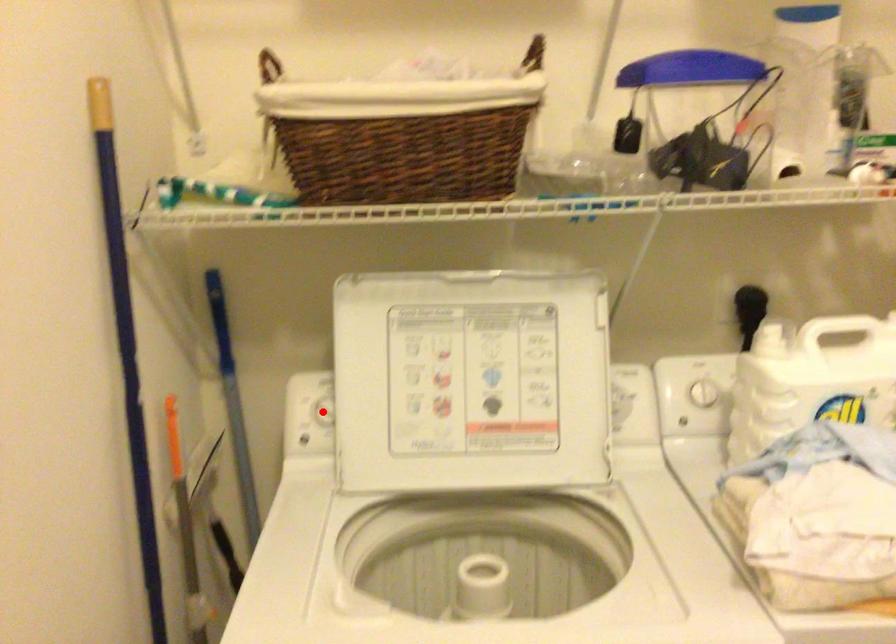
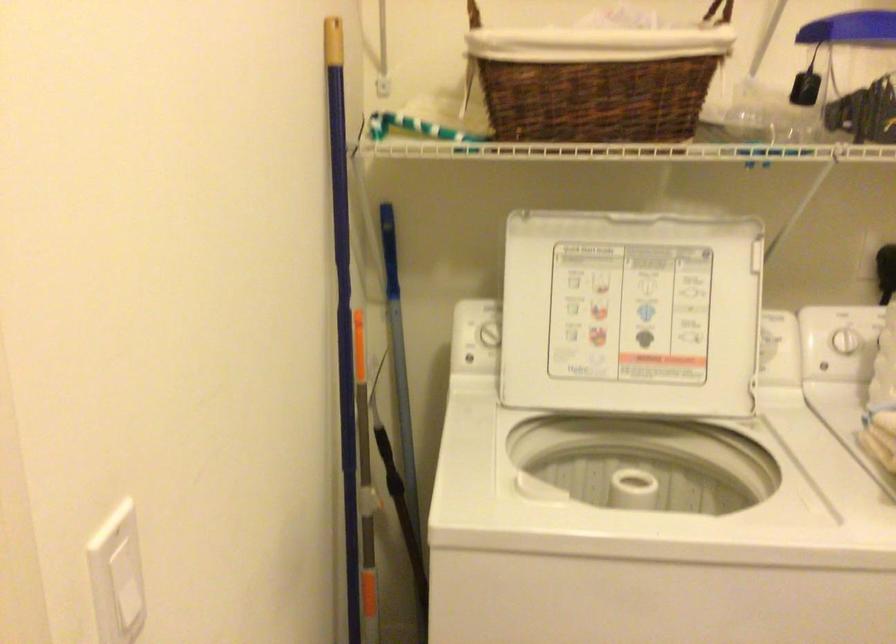
The point at the highlighted location is marked in the first image. Where is the corresponding point in the second image?

(488, 334)